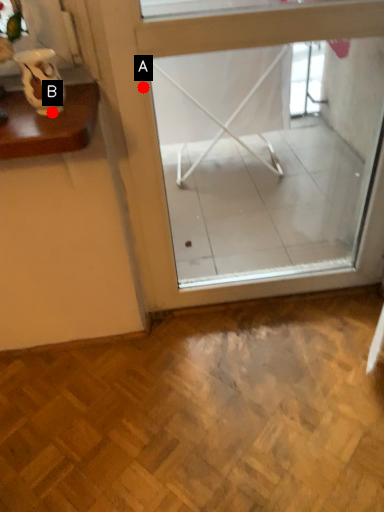
Question: Two points are circled on the image, labeled by A and B beside each circle. Among these points, which one is nearest to the camera?

Choices:
 (A) A is closer
 (B) B is closer

Answer: (B)